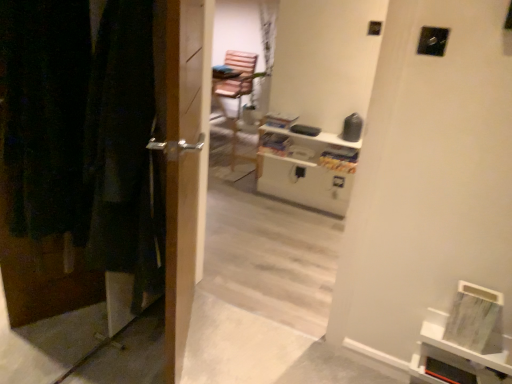
Question: Is white matte bookshelf at lower right completely or partially outside of wooden door at left?

Choices:
 (A) no
 (B) yes

Answer: (B)

Question: From a real-world perspective, is white matte bookshelf at lower right over wooden door at left?

Choices:
 (A) no
 (B) yes

Answer: (A)

Question: Can you confirm if white matte bookshelf at lower right is wider than wooden door at left?

Choices:
 (A) yes
 (B) no

Answer: (A)

Question: Can you see white matte bookshelf at lower right touching wooden door at left?

Choices:
 (A) yes
 (B) no

Answer: (B)

Question: Is white matte bookshelf at lower right shorter than wooden door at left?

Choices:
 (A) yes
 (B) no

Answer: (A)

Question: From their relative heights in the image, would you say white glossy entertainment center at upper center is taller or shorter than white matte bookshelf at lower right?

Choices:
 (A) short
 (B) tall

Answer: (A)

Question: In the image, is white glossy entertainment center at upper center on the left side or the right side of white matte bookshelf at lower right?

Choices:
 (A) right
 (B) left

Answer: (B)

Question: In the image, is white glossy entertainment center at upper center positioned in front of or behind white matte bookshelf at lower right?

Choices:
 (A) front
 (B) behind

Answer: (B)

Question: From a real-world perspective, is white glossy entertainment center at upper center positioned above or below white matte bookshelf at lower right?

Choices:
 (A) above
 (B) below

Answer: (A)

Question: Relative to white glossy entertainment center at upper center, is wooden door at left in front or behind?

Choices:
 (A) front
 (B) behind

Answer: (A)

Question: Does point (37, 196) appear closer or farther from the camera than point (301, 201)?

Choices:
 (A) closer
 (B) farther

Answer: (A)

Question: Is wooden door at left taller or shorter than white glossy entertainment center at upper center?

Choices:
 (A) short
 (B) tall

Answer: (B)

Question: Looking at the image, does wooden door at left seem bigger or smaller compared to white glossy entertainment center at upper center?

Choices:
 (A) small
 (B) big

Answer: (B)

Question: From the image's perspective, relative to white matte bookshelf at lower right, is metallic silver handle at left above or below?

Choices:
 (A) below
 (B) above

Answer: (B)

Question: In terms of height, does metallic silver handle at left look taller or shorter compared to white matte bookshelf at lower right?

Choices:
 (A) short
 (B) tall

Answer: (B)